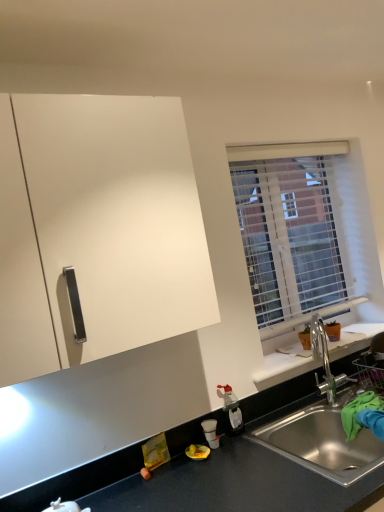
Question: Visually, is translucent plastic bottle at lower center positioned to the left or to the right of white translucent blinds at upper right?

Choices:
 (A) left
 (B) right

Answer: (A)

Question: Is point (228, 399) positioned closer to the camera than point (253, 175)?

Choices:
 (A) farther
 (B) closer

Answer: (B)

Question: Which object is the closest to the translucent plastic bottle at lower center?

Choices:
 (A) white matte cabinet at upper left
 (B) matte black countertop at lower center
 (C) stainless steel sink at lower right
 (D) white translucent blinds at upper right

Answer: (B)

Question: Considering the real-world distances, which object is farthest from the translucent plastic bottle at lower center?

Choices:
 (A) matte black countertop at lower center
 (B) white translucent blinds at upper right
 (C) stainless steel sink at lower right
 (D) white matte cabinet at upper left

Answer: (D)